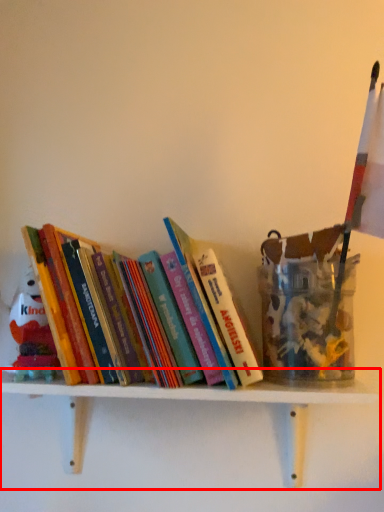
Question: From the image's perspective, what is the correct spatial relationship of shelf (annotated by the red box) in relation to book?

Choices:
 (A) below
 (B) above

Answer: (A)